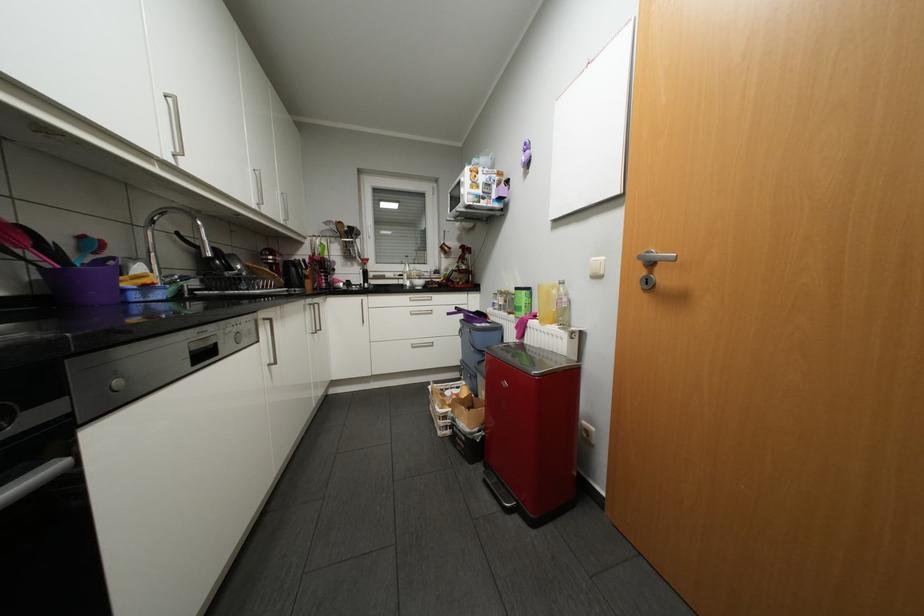
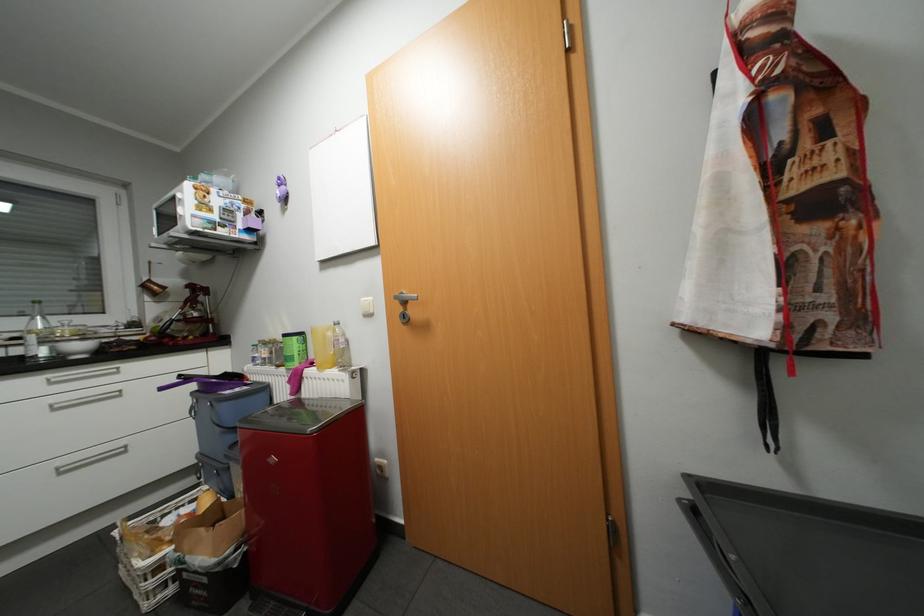
Find the pixel in the second image that matches [542,315] in the first image.

(320, 363)